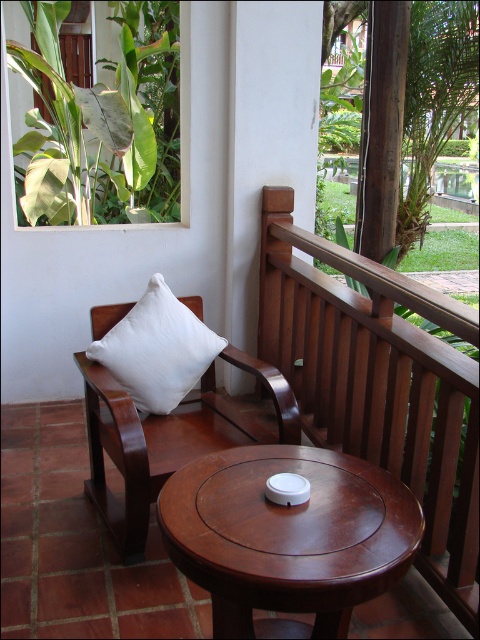
Between mahogany wood round table at center and white matte cushion at upper left, which one is positioned lower?

mahogany wood round table at center is lower down.

Which of these two, mahogany wood round table at center or white matte cushion at upper left, stands taller?

Standing taller between the two is white matte cushion at upper left.

You are a GUI agent. You are given a task and a screenshot of the screen. Output one action in this format:
    pyautogui.click(x=<x>, y=<y>)
    Task: Click on the mahogany wood round table at center
    This screenshot has height=640, width=480.
    Given the screenshot: What is the action you would take?
    pyautogui.click(x=288, y=536)

Measure the distance from green leafy plant at upper left to white matte cushion at upper left.

green leafy plant at upper left is 5.88 feet from white matte cushion at upper left.

Is green leafy plant at upper left positioned behind white matte cushion at upper left?

Yes, it is.

Between point (33, 64) and point (197, 442), which one is positioned behind?

The point (33, 64) is behind.

The width and height of the screenshot is (480, 640). I want to click on green leafy plant at upper left, so click(x=98, y=116).

What do you see at coordinates (377, 384) in the screenshot?
I see `brown wooden balustrade at upper right` at bounding box center [377, 384].

Is brown wooden balustrade at upper right positioned at the back of white cotton cushion at left?

No, brown wooden balustrade at upper right is in front of white cotton cushion at left.

Where is `brown wooden balustrade at upper right`? Image resolution: width=480 pixels, height=640 pixels. brown wooden balustrade at upper right is located at coordinates (377, 384).

Image resolution: width=480 pixels, height=640 pixels. Identify the location of brown wooden balustrade at upper right. (377, 384).